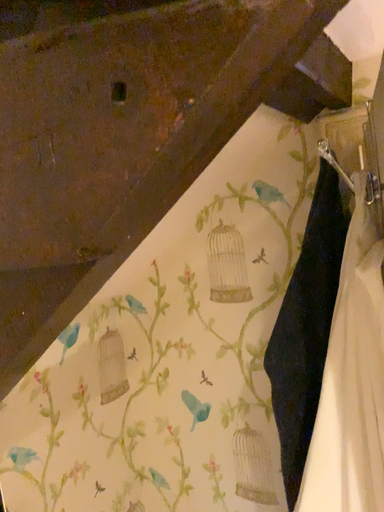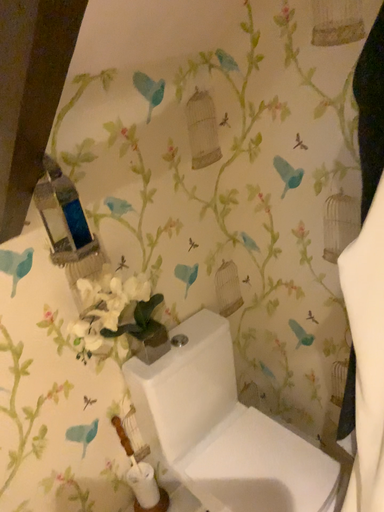
Question: Which way did the camera rotate in the video?

Choices:
 (A) rotated downward
 (B) rotated upward

Answer: (A)